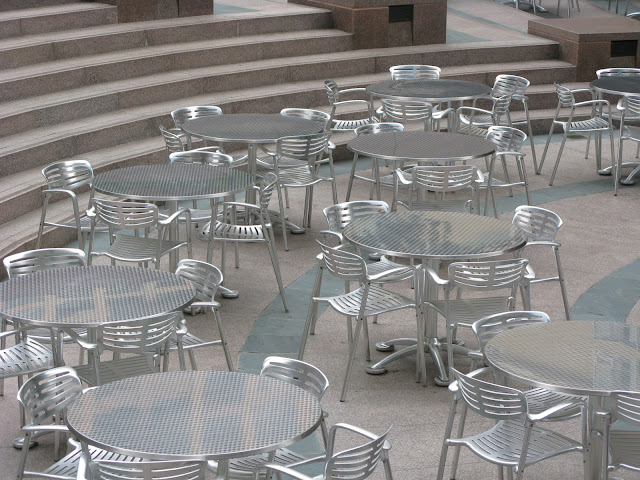
Find the location of a particular element. table 9 chairs is located at coordinates (566, 103), (612, 68), (628, 108).